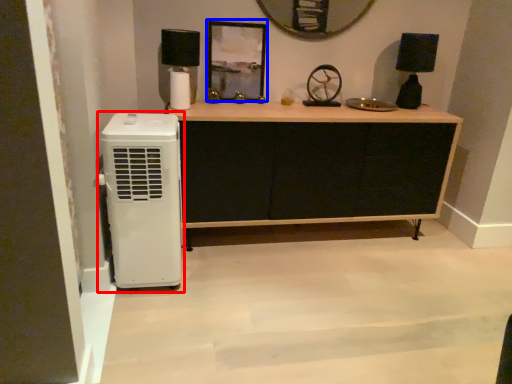
Question: Which of the following is the closest to the observer, home appliance (highlighted by a red box) or picture frame (highlighted by a blue box)?

Choices:
 (A) home appliance
 (B) picture frame

Answer: (A)